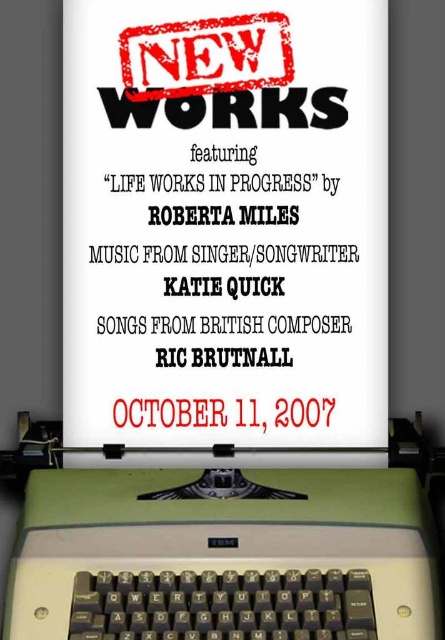
Question: Which object is closer to the camera taking this photo?

Choices:
 (A) white paper at center
 (B) green plastic typewriter at bottom

Answer: (B)

Question: Can you confirm if white paper at center is smaller than green plastic typewriter at bottom?

Choices:
 (A) no
 (B) yes

Answer: (B)

Question: Is white paper at center smaller than green plastic typewriter at bottom?

Choices:
 (A) yes
 (B) no

Answer: (A)

Question: Which of the following is the closest to the observer?

Choices:
 (A) white paper at center
 (B) green plastic typewriter at bottom

Answer: (B)

Question: Among these objects, which one is nearest to the camera?

Choices:
 (A) green plastic typewriter at bottom
 (B) white paper at center

Answer: (A)

Question: Does white paper at center lie in front of green plastic typewriter at bottom?

Choices:
 (A) yes
 (B) no

Answer: (B)